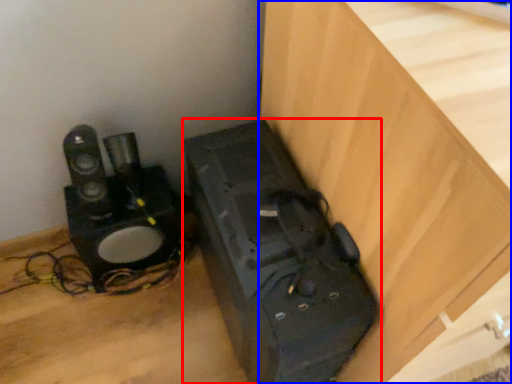
Question: Which object is further to the camera taking this photo, appliance (highlighted by a red box) or furniture (highlighted by a blue box)?

Choices:
 (A) appliance
 (B) furniture

Answer: (A)